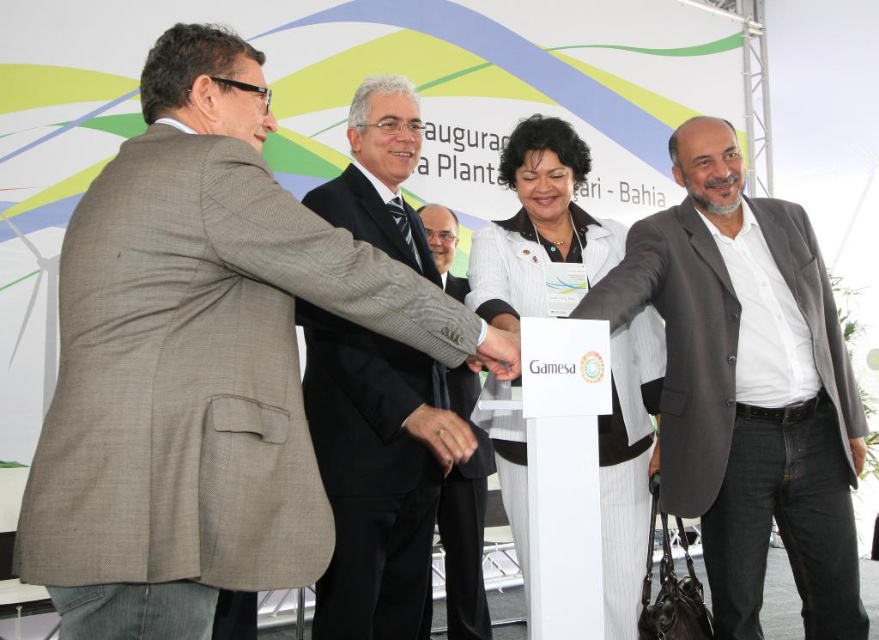
Does gray wool blazer at center come in front of black suit at center?

Yes, gray wool blazer at center is in front of black suit at center.

How much distance is there between gray wool blazer at center and black suit at center?

gray wool blazer at center and black suit at center are 38.04 inches apart.

Is point (838, 332) closer to camera compared to point (412, 432)?

No, (838, 332) is behind (412, 432).

Identify the location of gray wool blazer at center. point(747,387).

Between white textured blazer at center and light gray suit at center, which one appears on the right side from the viewer's perspective?

white textured blazer at center is more to the right.

Which is below, white textured blazer at center or light gray suit at center?

light gray suit at center is lower down.

Describe the element at coordinates (540, 230) in the screenshot. I see `white textured blazer at center` at that location.

The height and width of the screenshot is (640, 879). I want to click on white textured blazer at center, so click(540, 230).

Can you confirm if black suit at center is bigger than white textured blazer at center?

Incorrect, black suit at center is not larger than white textured blazer at center.

Who is positioned more to the right, black suit at center or white textured blazer at center?

Positioned to the right is white textured blazer at center.

The width and height of the screenshot is (879, 640). Describe the element at coordinates (389, 481) in the screenshot. I see `black suit at center` at that location.

I want to click on black suit at center, so click(389, 481).